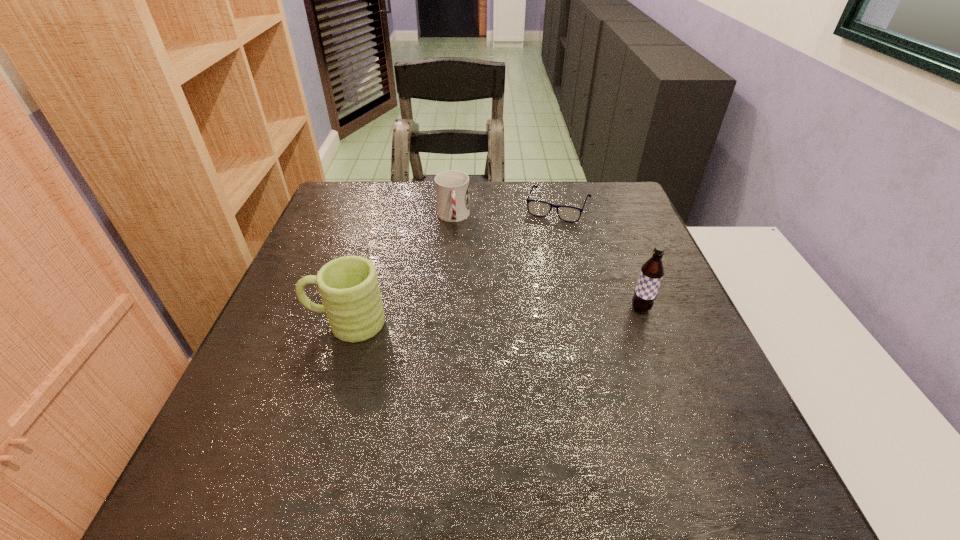
Locate an element on the screen. This screenshot has width=960, height=540. vacant space on the desktop that is between the leftmost object and the tallest object and is positioned on the front-facing side of the spectacles is located at coordinates (518, 315).

Identify the location of free space on the desktop that is between the leftmost object and the root beer and is positioned on the side of the third tallest object where the handle is located. (464, 318).